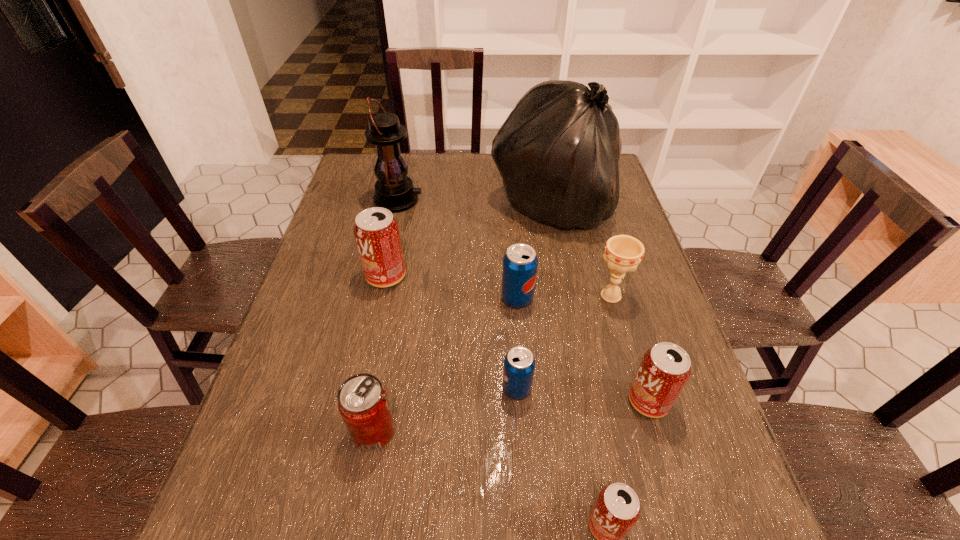
Locate an element on the screen. The width and height of the screenshot is (960, 540). plastic bag at the right edge is located at coordinates (558, 152).

Locate an element on the screen. This screenshot has width=960, height=540. chalice present at the right edge is located at coordinates (623, 253).

You are a GUI agent. You are given a task and a screenshot of the screen. Output one action in this format:
    pyautogui.click(x=<x>, y=<y>)
    Task: Click on the soda can present at the right edge
    
    Given the screenshot: What is the action you would take?
    pyautogui.click(x=665, y=368)

You are a GUI agent. You are given a task and a screenshot of the screen. Output one action in this format:
    pyautogui.click(x=<x>, y=<y>)
    Task: Click on the object at the far left corner
    
    Given the screenshot: What is the action you would take?
    pyautogui.click(x=394, y=190)

Find the location of a particular element. The height and width of the screenshot is (540, 960). object that is at the far right corner is located at coordinates pyautogui.click(x=558, y=152).

What are the coordinates of `vacant space at the far edge of the desktop` in the screenshot? It's located at (464, 165).

In order to click on blank area at the near edge in this screenshot , I will do `click(368, 530)`.

Find the location of a particular element. vacant area at the left edge of the desktop is located at coordinates [x=302, y=316].

Locate an element on the screen. The height and width of the screenshot is (540, 960). free space at the right edge is located at coordinates (612, 221).

Locate an element on the screen. This screenshot has width=960, height=540. free location at the far left corner is located at coordinates (351, 190).